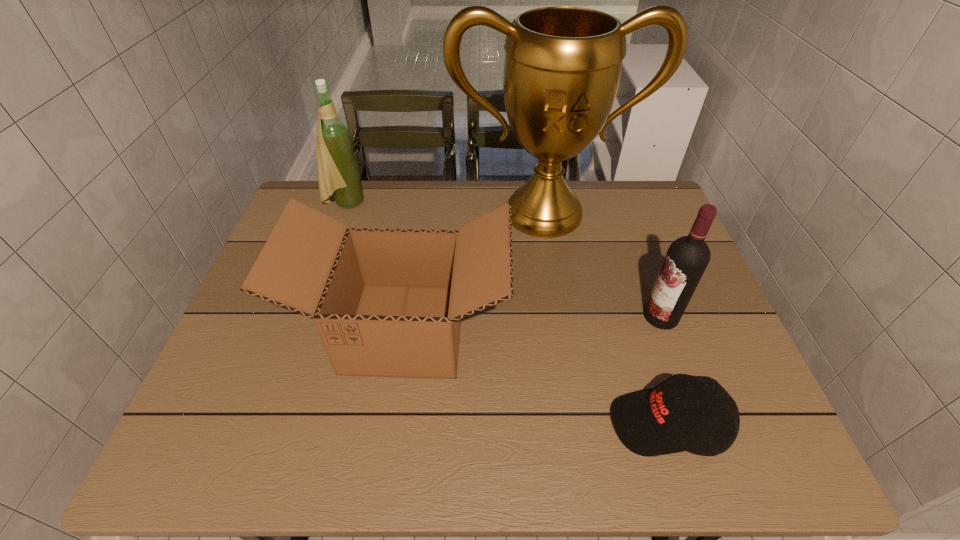
The height and width of the screenshot is (540, 960). I want to click on box that is at the left edge, so click(386, 302).

I want to click on trophy cup that is at the right edge, so click(562, 69).

Where is `wine bottle positioned at the right edge`? wine bottle positioned at the right edge is located at coordinates (687, 257).

Locate an element on the screen. baseball cap that is at the right edge is located at coordinates (651, 422).

Identify the location of object that is positioned at the far left corner. Image resolution: width=960 pixels, height=540 pixels. (338, 175).

This screenshot has width=960, height=540. Find the location of `object present at the far right corner`. object present at the far right corner is located at coordinates (562, 69).

Where is `object located at the near right corner`? The width and height of the screenshot is (960, 540). object located at the near right corner is located at coordinates (651, 422).

Image resolution: width=960 pixels, height=540 pixels. Find the location of `vacant space at the far edge of the desktop`. vacant space at the far edge of the desktop is located at coordinates (410, 181).

I want to click on vacant space at the near edge of the desktop, so click(x=504, y=426).

Find the location of a particular element. This screenshot has width=960, height=540. blank space at the right edge is located at coordinates 715,336.